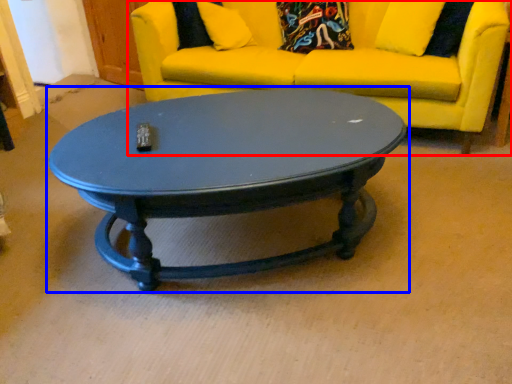
Question: Which point is further to the camera, studio couch (highlighted by a red box) or coffee table (highlighted by a blue box)?

Choices:
 (A) studio couch
 (B) coffee table

Answer: (A)